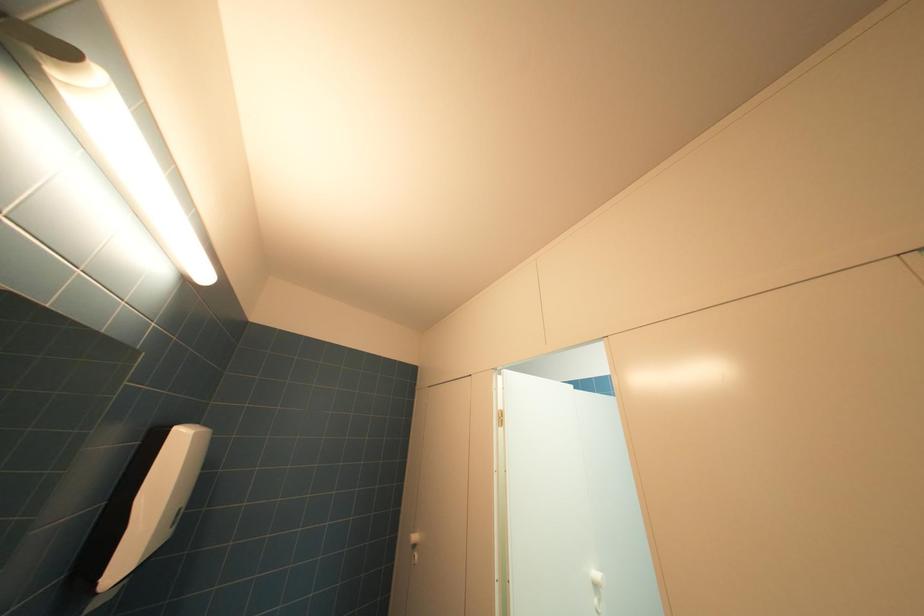
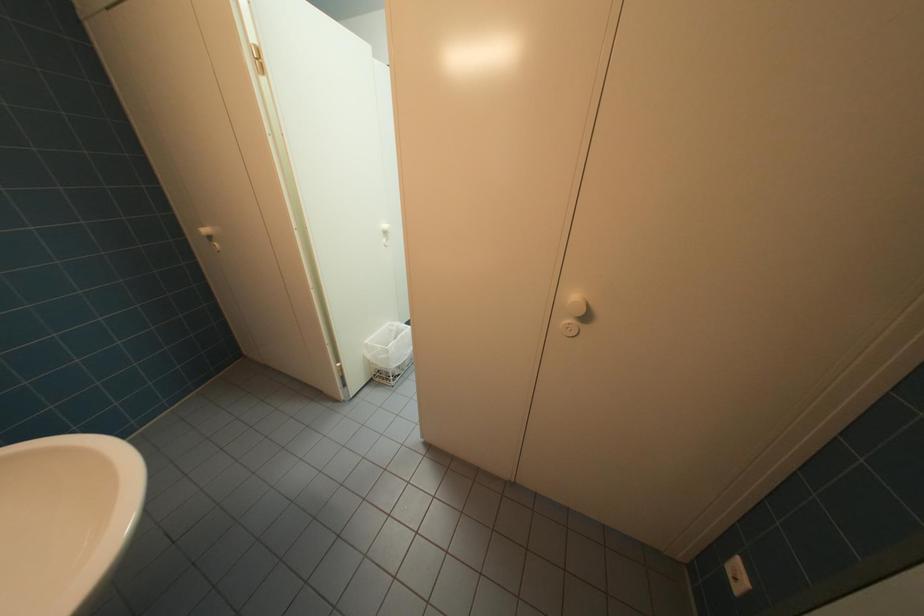
Based on the continuous images, in which direction is the camera rotating?

The camera's rotation is toward right-down.